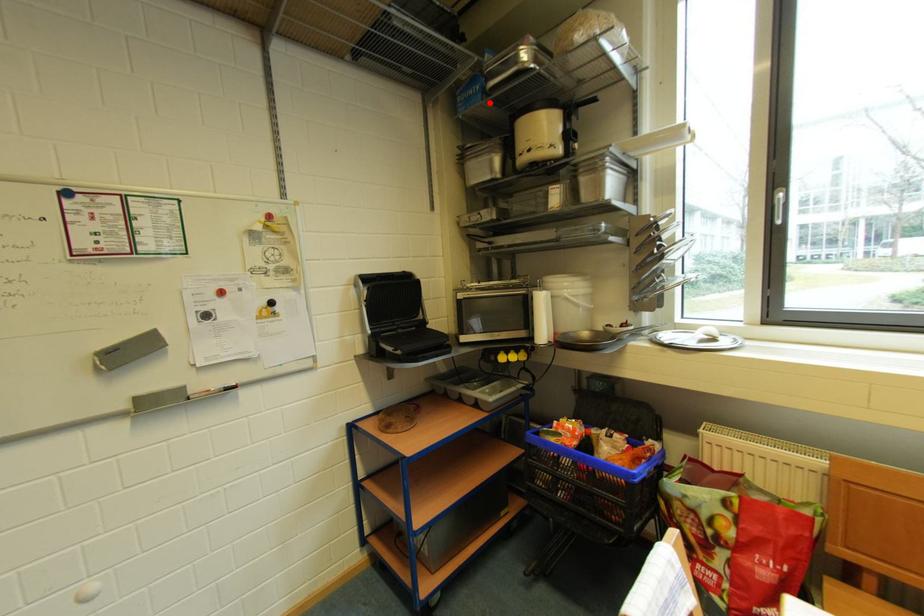
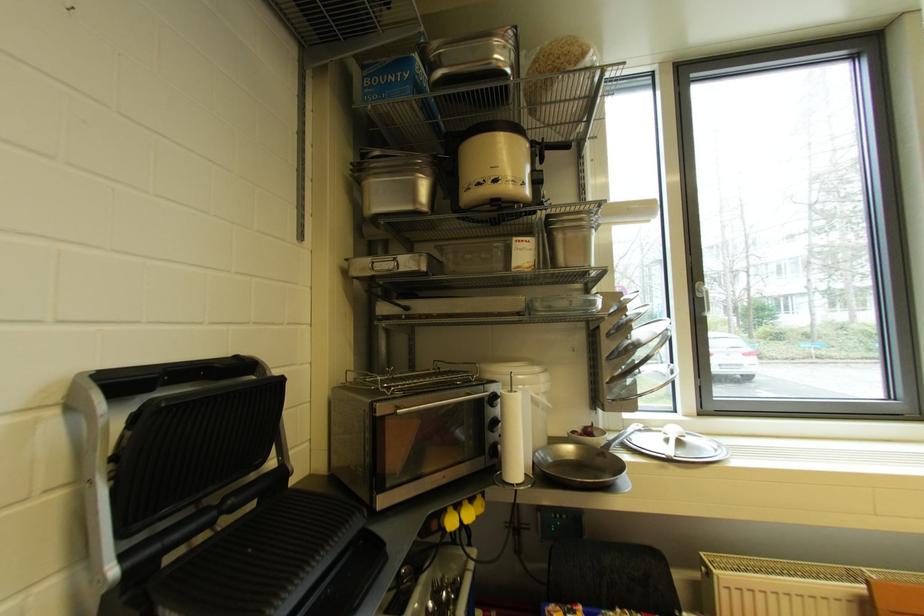
Find the pixel in the second image that matches the highlighted location in the first image.

(420, 97)